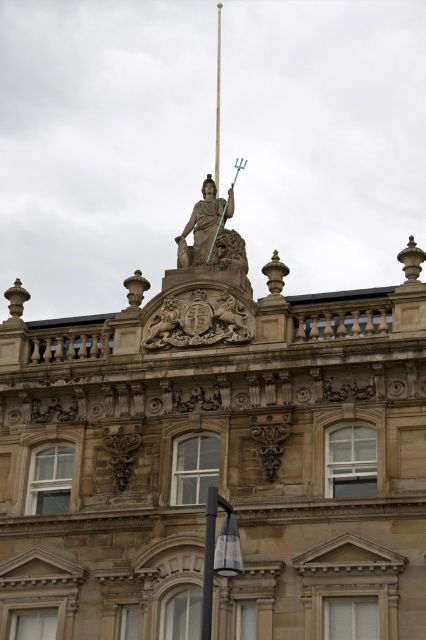
You are standing in front of the grand historic building. You notice two points marked on the building facade. The first point is at coordinates point (236, 317) and the second point is at point (215, 189). From your perspective, which point is closer to you?

Point (236, 317) is in front of point (215, 189), so the first point is closer to you.

Based on the scene description, where is the brown stone statue at upper center located in terms of its 2D coordinates?

The brown stone statue at upper center is located at coordinates (216,464).

You are a window cleaner who needs to clean the windows of the building. You have a ladder that can reach up to 40 feet. The brown stone statue at upper center and the green glass pole at upper center are both located at the upper center of the building. Which object can you reach with your ladder?

The brown stone statue at upper center and green glass pole at upper center are 43.98 feet apart from each other. Since the ladder can only reach up to 40 feet, neither of the objects can be reached with the ladder.